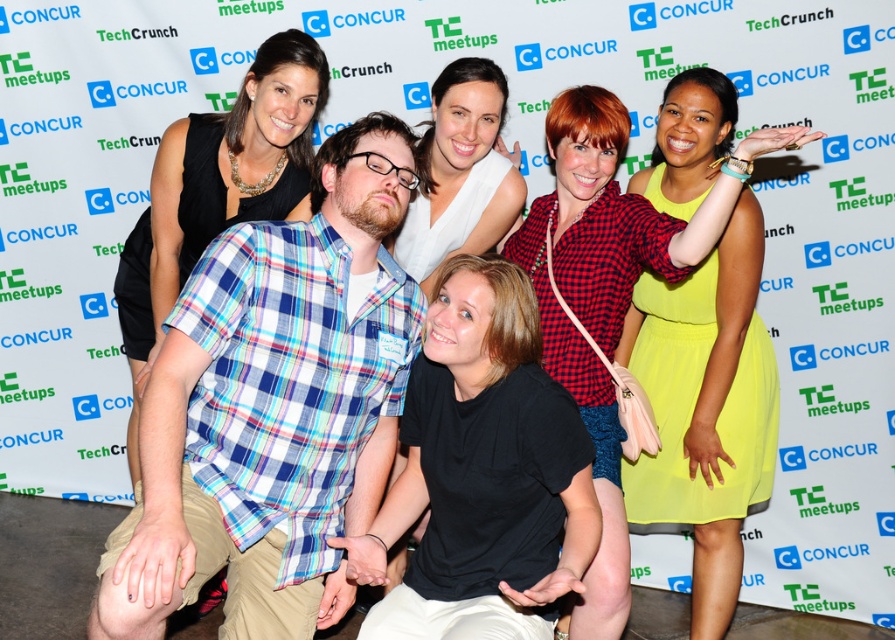
Is the position of matte red checkered shirt at center more distant than that of black jersey at center?

No.

You are a GUI agent. You are given a task and a screenshot of the screen. Output one action in this format:
    pyautogui.click(x=<x>, y=<y>)
    Task: Click on the matte red checkered shirt at center
    
    Given the screenshot: What is the action you would take?
    pyautogui.click(x=599, y=301)

Image resolution: width=895 pixels, height=640 pixels. Find the location of `matte red checkered shirt at center`. matte red checkered shirt at center is located at coordinates point(599,301).

Does black matte shirt at center have a smaller size compared to matte white blouse at upper center?

Actually, black matte shirt at center might be larger than matte white blouse at upper center.

What do you see at coordinates (484, 468) in the screenshot? I see `black matte shirt at center` at bounding box center [484, 468].

Image resolution: width=895 pixels, height=640 pixels. In order to click on black matte shirt at center in this screenshot , I will do `click(484, 468)`.

Between point (313, 516) and point (699, 150), which one is positioned in front?

Point (313, 516) is in front.

Which is behind, point (243, 362) or point (669, 102)?

Point (669, 102)

Identify the location of plaid cotton shirt at center. (271, 410).